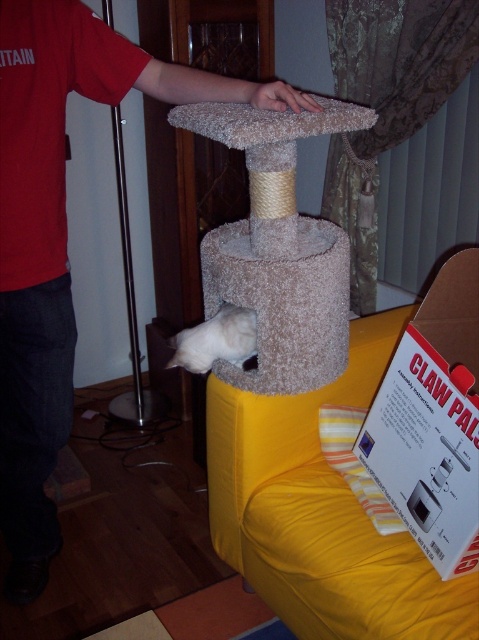
You are organizing a room and see the red cotton shirt at upper left and the white fluffy cat at lower center. Which object is positioned lower in the room?

The red cotton shirt at upper left is located below the white fluffy cat at lower center, so the red cotton shirt at upper left is positioned lower in the room.

Consider the image. You are organizing a photo album and notice the red cotton shirt at upper left and the white fluffy cat at lower center in the image. Which object is positioned more to the left side of the image?

The red cotton shirt at upper left is positioned more to the left side of the image than the white fluffy cat at lower center.